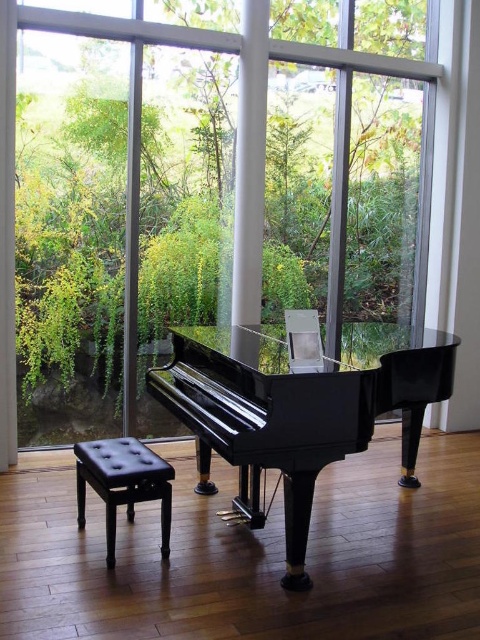
You are a piano teacher entering the room and want to position your student so they can see both the glossy black piano at center and the transparent glass window at center. Which side of the piano should the student stand to have a clear view of both?

The student should stand to the left of the glossy black piano at center because the piano is to the right of the transparent glass window at center, so standing left would allow them to see both the piano and the window.

You are a piano teacher entering the room and want to sit on the black leather stool at lower left to demonstrate a piece. Can you walk directly to the stool without moving around the glossy black piano at center?

The glossy black piano at center is in front of the black leather stool at lower left, so you would need to walk around the piano to reach the stool.

You are a piano teacher who wants to adjust the position of the black leather stool at lower left so that it is closer to the glossy black piano at center. Currently, how far apart are they?

The glossy black piano at center is 27.03 inches away from the black leather stool at lower left.